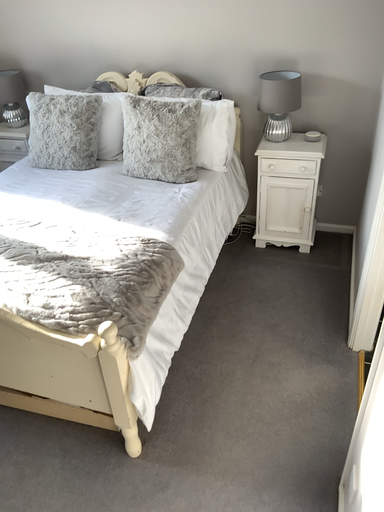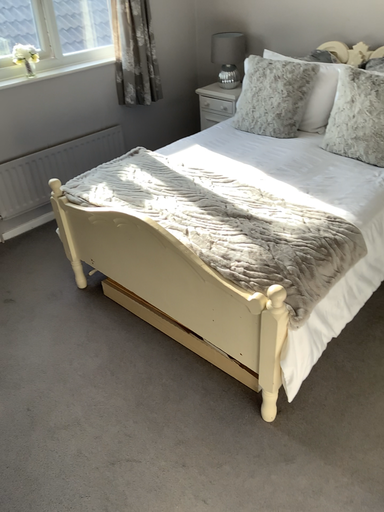
Question: Which way did the camera rotate in the video?

Choices:
 (A) rotated left
 (B) rotated right

Answer: (A)